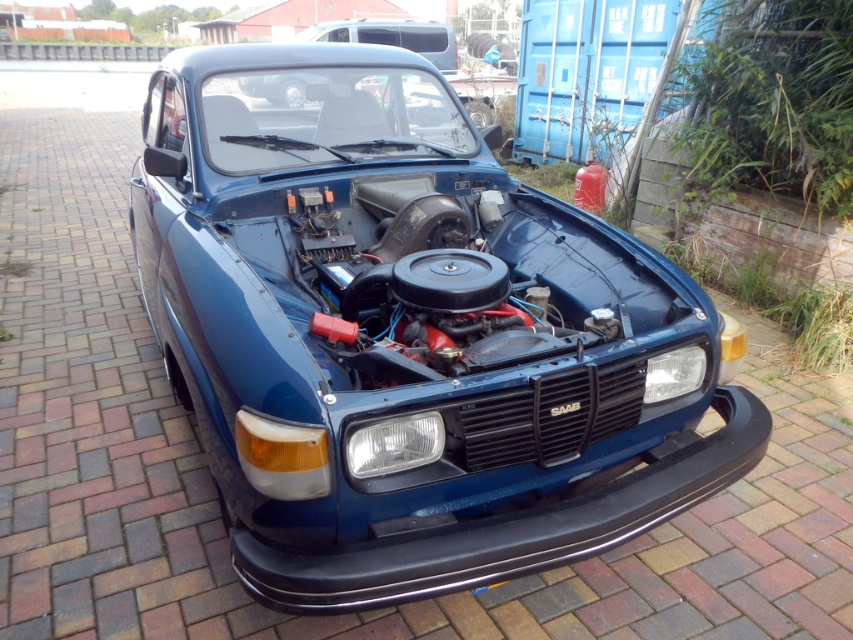
Question: Is glossy blue car at center positioned at the back of matte blue car at center?

Choices:
 (A) yes
 (B) no

Answer: (B)

Question: Does glossy blue car at center have a lesser width compared to matte blue car at center?

Choices:
 (A) yes
 (B) no

Answer: (A)

Question: Considering the relative positions of glossy blue car at center and matte blue car at center in the image provided, where is glossy blue car at center located with respect to matte blue car at center?

Choices:
 (A) right
 (B) left

Answer: (A)

Question: Which of the following is the closest to the observer?

Choices:
 (A) (456, 333)
 (B) (239, 88)

Answer: (A)

Question: Among these objects, which one is nearest to the camera?

Choices:
 (A) matte blue car at center
 (B) glossy blue car at center

Answer: (B)